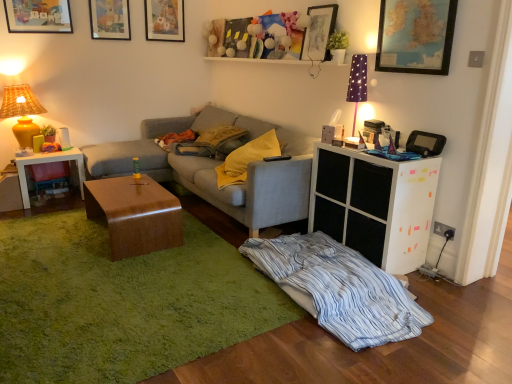
Find the location of a particular element. The width and height of the screenshot is (512, 384). free spot to the right of glossy wood coffee table at center is located at coordinates (204, 245).